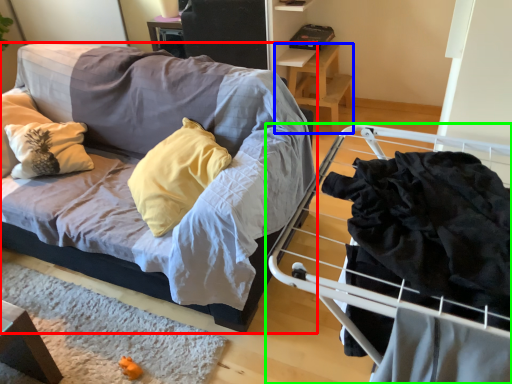
Question: Which object is positioned closest to studio couch (highlighted by a red box)? Select from table (highlighted by a blue box) and furniture (highlighted by a green box).

Choices:
 (A) table
 (B) furniture

Answer: (B)